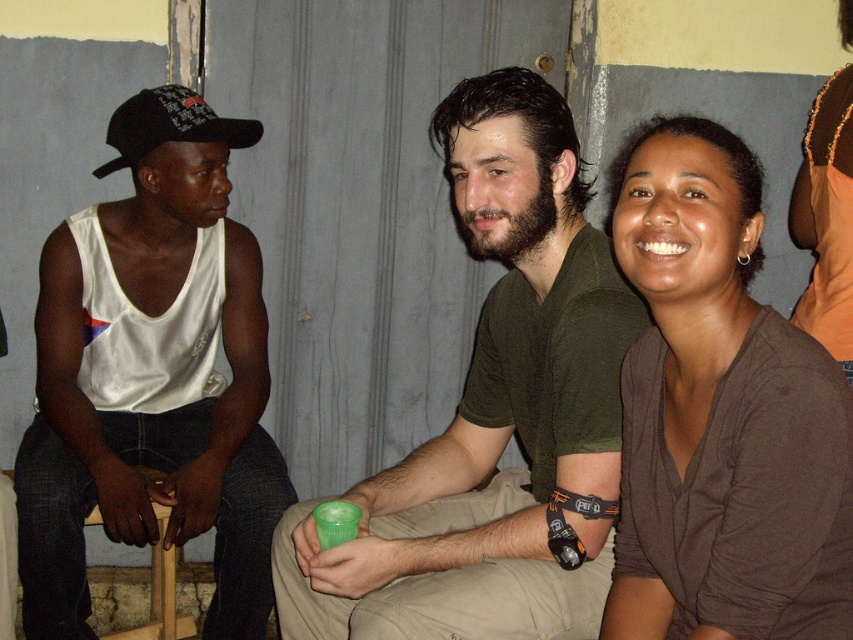
You are a waiter carrying a tray of drinks. You need to place a drink on the table between the green matte cup at center and the wooden chair at lower left. The tray is 28 inches wide. Can you fit the tray between them without spilling?

The distance between the green matte cup at center and the wooden chair at lower left is 29.14 inches. Since the tray is 28 inches wide, it can fit comfortably between them without spilling.

You are a photographer standing in front of the three people. You need to take a photo that includes both the green matte cup at center and the brown soft shirt at upper right. Which object should you focus on first to ensure both are in the frame?

The green matte cup at center is located below the brown soft shirt at upper right, so you should focus on the brown soft shirt at upper right first to ensure both are in the frame.